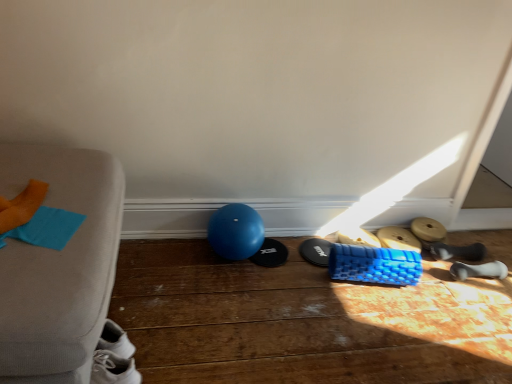
What do you see at coordinates (358, 237) in the screenshot? The image size is (512, 384). I see `blue textured foam roller at center, which is the fifth footwear from right to left` at bounding box center [358, 237].

The height and width of the screenshot is (384, 512). Describe the element at coordinates (479, 270) in the screenshot. I see `white rubber dumbbell at lower right, which is the 1th footwear from right to left` at that location.

Image resolution: width=512 pixels, height=384 pixels. What do you see at coordinates (398, 239) in the screenshot?
I see `blue textured foam roller at lower right, which is counted as the fourth footwear, starting from the right` at bounding box center [398, 239].

Image resolution: width=512 pixels, height=384 pixels. Describe the element at coordinates (59, 265) in the screenshot. I see `fabric couch at left` at that location.

This screenshot has height=384, width=512. What are the coordinates of `blue textured foam roller at center, which ranks as the 2th footwear in left-to-right order` in the screenshot? It's located at (315, 251).

What do you see at coordinates (315, 251) in the screenshot?
I see `blue textured foam roller at center, which ranks as the 2th footwear in left-to-right order` at bounding box center [315, 251].

Identify the location of black rubber mat at center, the first footwear when ordered from left to right. This screenshot has width=512, height=384. (270, 254).

Locate an element on the screen. blue textured foam roller at center, which is the third footwear in left-to-right order is located at coordinates (358, 237).

Is black rubber shoe at lower right, the 6th footwear viewed from the left, not inside blue textured foam roller at center, which ranks as the 2th footwear in left-to-right order?

black rubber shoe at lower right, the 6th footwear viewed from the left, is positioned outside blue textured foam roller at center, which ranks as the 2th footwear in left-to-right order.

Considering the sizes of black rubber shoe at lower right, which appears as the 2th footwear when viewed from the right, and blue textured foam roller at center, which is the 6th footwear from right to left, in the image, is black rubber shoe at lower right, which appears as the 2th footwear when viewed from the right, taller or shorter than blue textured foam roller at center, which is the 6th footwear from right to left,?

In the image, black rubber shoe at lower right, which appears as the 2th footwear when viewed from the right, appears to be taller than blue textured foam roller at center, which is the 6th footwear from right to left.

Looking at this image, between black rubber shoe at lower right, the 6th footwear viewed from the left, and blue textured foam roller at center, which ranks as the 2th footwear in left-to-right order, which one has larger size?

Bigger between the two is black rubber shoe at lower right, the 6th footwear viewed from the left.

Between black rubber mat at center, the seventh footwear viewed from the right, and blue textured foam roller at center, which is the third footwear in left-to-right order, which one appears on the right side from the viewer's perspective?

From the viewer's perspective, blue textured foam roller at center, which is the third footwear in left-to-right order, appears more on the right side.

From the image's perspective, between black rubber mat at center, the first footwear when ordered from left to right, and blue textured foam roller at center, which is the third footwear in left-to-right order, who is located below?

black rubber mat at center, the first footwear when ordered from left to right, appears lower in the image.

Can we say black rubber mat at center, the first footwear when ordered from left to right, lies outside blue textured foam roller at center, which is the fifth footwear from right to left?

That's correct, black rubber mat at center, the first footwear when ordered from left to right, is outside of blue textured foam roller at center, which is the fifth footwear from right to left.

Does point (260, 262) lie in front of point (337, 236)?

Yes, it is in front of point (337, 236).

Is black rubber shoe at lower right, the 6th footwear viewed from the left, completely or partially inside blue textured foam roller at lower right, which is counted as the fourth footwear, starting from the right?

Actually, black rubber shoe at lower right, the 6th footwear viewed from the left, is outside blue textured foam roller at lower right, which is counted as the fourth footwear, starting from the right.

There is a black rubber shoe at lower right, which appears as the 2th footwear when viewed from the right. At what (x,y) coordinates should I click in order to perform the action: click on the 3rd footwear above it (from the image's perspective). Please return your answer as a coordinate pair (x, y). Looking at the image, I should click on (398, 239).

From the picture: Is blue textured foam roller at lower right, the 4th footwear when ordered from left to right, next to black rubber shoe at lower right, the 6th footwear viewed from the left?

No, blue textured foam roller at lower right, the 4th footwear when ordered from left to right, is not touching black rubber shoe at lower right, the 6th footwear viewed from the left.

Is blue textured foam roller at lower right, the 4th footwear when ordered from left to right, oriented towards black rubber shoe at lower right, which appears as the 2th footwear when viewed from the right?

No, blue textured foam roller at lower right, the 4th footwear when ordered from left to right, does not turn towards black rubber shoe at lower right, which appears as the 2th footwear when viewed from the right.

Can you confirm if fabric couch at left is shorter than blue textured foam roller at lower right, the 4th footwear when ordered from left to right?

No, fabric couch at left is not shorter than blue textured foam roller at lower right, the 4th footwear when ordered from left to right.

Is fabric couch at left facing away from blue textured foam roller at lower right, which is counted as the fourth footwear, starting from the right?

No, blue textured foam roller at lower right, which is counted as the fourth footwear, starting from the right, is not at the back of fabric couch at left.

In the scene shown: From the image's perspective, is fabric couch at left positioned above or below blue textured foam roller at lower right, the 4th footwear when ordered from left to right?

Clearly, from the image's perspective, fabric couch at left is below blue textured foam roller at lower right, the 4th footwear when ordered from left to right.

Between point (15, 244) and point (402, 231), which one is positioned in front?

Positioned in front is point (15, 244).

Looking at the image, does black rubber mat at center, the seventh footwear viewed from the right, seem bigger or smaller compared to fabric couch at left?

In the image, black rubber mat at center, the seventh footwear viewed from the right, appears to be smaller than fabric couch at left.

In the scene shown: Considering the positions of objects black rubber mat at center, the first footwear when ordered from left to right, and fabric couch at left in the image provided, who is more to the left, black rubber mat at center, the first footwear when ordered from left to right, or fabric couch at left?

fabric couch at left.

Is black rubber mat at center, the seventh footwear viewed from the right, aimed at fabric couch at left?

No, black rubber mat at center, the seventh footwear viewed from the right, is not oriented towards fabric couch at left.

Would you say fabric couch at left is inside or outside white rubber dumbbell at lower right, the 7th footwear viewed from the left?

fabric couch at left is not inside white rubber dumbbell at lower right, the 7th footwear viewed from the left, it's outside.

Considering the relative sizes of fabric couch at left and white rubber dumbbell at lower right, the 7th footwear viewed from the left, in the image provided, is fabric couch at left thinner than white rubber dumbbell at lower right, the 7th footwear viewed from the left,?

No, fabric couch at left is not thinner than white rubber dumbbell at lower right, the 7th footwear viewed from the left.

Is fabric couch at left beside white rubber dumbbell at lower right, the 7th footwear viewed from the left?

fabric couch at left is not next to white rubber dumbbell at lower right, the 7th footwear viewed from the left, and they're not touching.

From the image's perspective, which one is positioned lower, fabric couch at left or white rubber dumbbell at lower right, the 7th footwear viewed from the left?

From the image's view, white rubber dumbbell at lower right, the 7th footwear viewed from the left, is below.

Is blue textured foam roller at center, which is the 6th footwear from right to left, spatially inside blue rubber ball at center, or outside of it?

blue textured foam roller at center, which is the 6th footwear from right to left, is spatially situated outside blue rubber ball at center.

Does point (317, 253) appear closer or farther from the camera than point (218, 243)?

Point (317, 253) is positioned farther from the camera compared to point (218, 243).

Does blue textured foam roller at center, which is the 6th footwear from right to left, have a lesser width compared to blue rubber ball at center?

Yes.

Can you confirm if blue textured foam roller at center, which is the 6th footwear from right to left, is bigger than blue rubber ball at center?

No.

Find the location of a particular element. footwear that is the 1st object located above the black rubber shoe at lower right, which appears as the 2th footwear when viewed from the right (from the image's perspective) is located at coordinates (315, 251).

Locate an element on the screen. This screenshot has height=384, width=512. the 2nd footwear counting from the left side of the blue textured foam roller at center, which is the third footwear in left-to-right order is located at coordinates (270, 254).

Looking at the image, which one is located closer to blue textured foam roller at lower right, which is counted as the fourth footwear, starting from the right, wooden dumbbell at lower right, which appears as the fifth footwear when viewed from the left, or white rubber dumbbell at lower right, which is the 1th footwear from right to left?

wooden dumbbell at lower right, which appears as the fifth footwear when viewed from the left, is closer to blue textured foam roller at lower right, which is counted as the fourth footwear, starting from the right.

Which object lies nearer to the anchor point white rubber dumbbell at lower right, which is the 1th footwear from right to left, blue textured foam roller at lower right, the 4th footwear when ordered from left to right, or black rubber mat at center, the seventh footwear viewed from the right?

Based on the image, blue textured foam roller at lower right, the 4th footwear when ordered from left to right, appears to be nearer to white rubber dumbbell at lower right, which is the 1th footwear from right to left.

Considering their positions, is black rubber mat at center, the seventh footwear viewed from the right, positioned further to wooden dumbbell at lower right, which is the 3th footwear from right to left, than blue textured foam roller at center, which ranks as the 2th footwear in left-to-right order?

Based on the image, black rubber mat at center, the seventh footwear viewed from the right, appears to be further to wooden dumbbell at lower right, which is the 3th footwear from right to left.

When comparing their distances from blue textured foam roller at lower right, which is counted as the fourth footwear, starting from the right, does white rubber dumbbell at lower right, the 7th footwear viewed from the left, or blue textured foam roller at center, which is the 6th footwear from right to left, seem closer?

white rubber dumbbell at lower right, the 7th footwear viewed from the left, is positioned closer to the anchor blue textured foam roller at lower right, which is counted as the fourth footwear, starting from the right.

Estimate the real-world distances between objects in this image. Which object is closer to white rubber dumbbell at lower right, the 7th footwear viewed from the left, black rubber mat at center, the seventh footwear viewed from the right, or blue textured foam roller at center, which is the third footwear in left-to-right order?

The object closer to white rubber dumbbell at lower right, the 7th footwear viewed from the left, is blue textured foam roller at center, which is the third footwear in left-to-right order.

Considering their positions, is black rubber shoe at lower right, the 6th footwear viewed from the left, positioned further to blue textured foam roller at center, which is the third footwear in left-to-right order, than blue textured foam roller at center, which is the 6th footwear from right to left?

black rubber shoe at lower right, the 6th footwear viewed from the left, is further to blue textured foam roller at center, which is the third footwear in left-to-right order.

Looking at the image, which one is located closer to black rubber mat at center, the seventh footwear viewed from the right, blue textured foam roller at center, which is the third footwear in left-to-right order, or wooden dumbbell at lower right, which appears as the fifth footwear when viewed from the left?

blue textured foam roller at center, which is the third footwear in left-to-right order, is closer to black rubber mat at center, the seventh footwear viewed from the right.

From the picture: Which object lies nearer to the anchor point black rubber mat at center, the seventh footwear viewed from the right, fabric couch at left or blue textured foam roller at lower right, the 4th footwear when ordered from left to right?

The object closer to black rubber mat at center, the seventh footwear viewed from the right, is blue textured foam roller at lower right, the 4th footwear when ordered from left to right.

At what (x,y) coordinates should I click in order to perform the action: click on balloon positioned between fabric couch at left and blue textured foam roller at center, which ranks as the 2th footwear in left-to-right order, from near to far. Please return your answer as a coordinate pair (x, y). The width and height of the screenshot is (512, 384). Looking at the image, I should click on (234, 231).

Where is `balloon between fabric couch at left and blue textured foam roller at center, which is the third footwear in left-to-right order, in the front-back direction`? balloon between fabric couch at left and blue textured foam roller at center, which is the third footwear in left-to-right order, in the front-back direction is located at coordinates (234, 231).

Find the location of a particular element. The image size is (512, 384). balloon between fabric couch at left and black rubber shoe at lower right, the 6th footwear viewed from the left, from left to right is located at coordinates (234, 231).

You are a GUI agent. You are given a task and a screenshot of the screen. Output one action in this format:
    pyautogui.click(x=<x>, y=<y>)
    Task: Click on the balloon between fabric couch at left and blue textured foam roller at lower right, the 4th footwear when ordered from left to right, from left to right
    
    Given the screenshot: What is the action you would take?
    pyautogui.click(x=234, y=231)